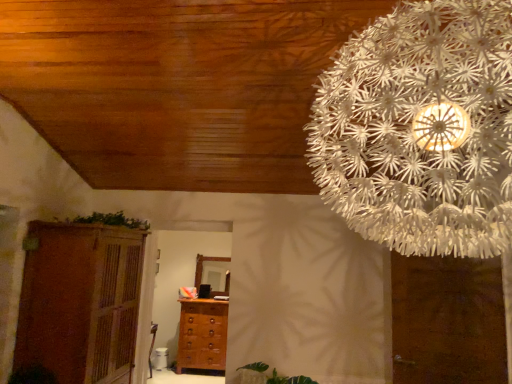
Question: From a real-world perspective, is white paper flower at upper right under brown matte door at upper right?

Choices:
 (A) yes
 (B) no

Answer: (B)

Question: Is white paper flower at upper right shorter than brown matte door at upper right?

Choices:
 (A) yes
 (B) no

Answer: (A)

Question: From the image's perspective, is white paper flower at upper right above brown matte door at upper right?

Choices:
 (A) yes
 (B) no

Answer: (A)

Question: Is white paper flower at upper right looking in the opposite direction of brown matte door at upper right?

Choices:
 (A) no
 (B) yes

Answer: (A)

Question: Is white paper flower at upper right at the left side of brown matte door at upper right?

Choices:
 (A) no
 (B) yes

Answer: (B)

Question: Are white paper flower at upper right and brown matte door at upper right beside each other?

Choices:
 (A) no
 (B) yes

Answer: (A)

Question: From the image's perspective, is brown matte door at upper right beneath brown wooden cupboard at left?

Choices:
 (A) yes
 (B) no

Answer: (B)

Question: Considering the relative sizes of brown matte door at upper right and brown wooden cupboard at left in the image provided, is brown matte door at upper right thinner than brown wooden cupboard at left?

Choices:
 (A) yes
 (B) no

Answer: (A)

Question: Can you confirm if brown matte door at upper right is bigger than brown wooden cupboard at left?

Choices:
 (A) no
 (B) yes

Answer: (A)

Question: Considering the relative positions of brown matte door at upper right and brown wooden cupboard at left in the image provided, is brown matte door at upper right to the left of brown wooden cupboard at left from the viewer's perspective?

Choices:
 (A) no
 (B) yes

Answer: (A)

Question: Are brown matte door at upper right and brown wooden cupboard at left located far from each other?

Choices:
 (A) no
 (B) yes

Answer: (B)

Question: Does brown matte door at upper right have a greater height compared to brown wooden cupboard at left?

Choices:
 (A) yes
 (B) no

Answer: (B)

Question: Is brown wooden cupboard at left in front of brown matte door at upper right?

Choices:
 (A) no
 (B) yes

Answer: (A)